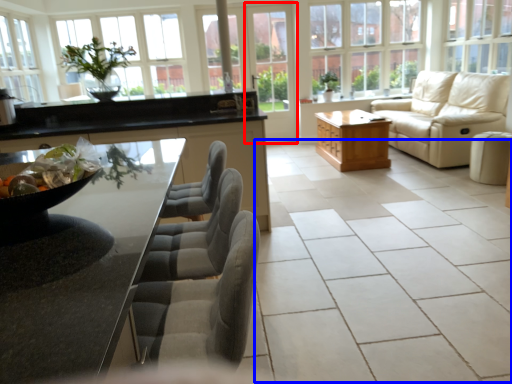
Question: Which of the following is the farthest to the observer, screen door (highlighted by a red box) or ceramic tile (highlighted by a blue box)?

Choices:
 (A) screen door
 (B) ceramic tile

Answer: (A)